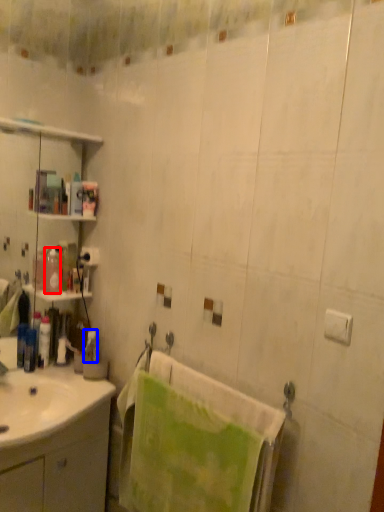
Question: Which object is further to the camera taking this photo, toiletry (highlighted by a red box) or toiletry (highlighted by a blue box)?

Choices:
 (A) toiletry
 (B) toiletry

Answer: (B)